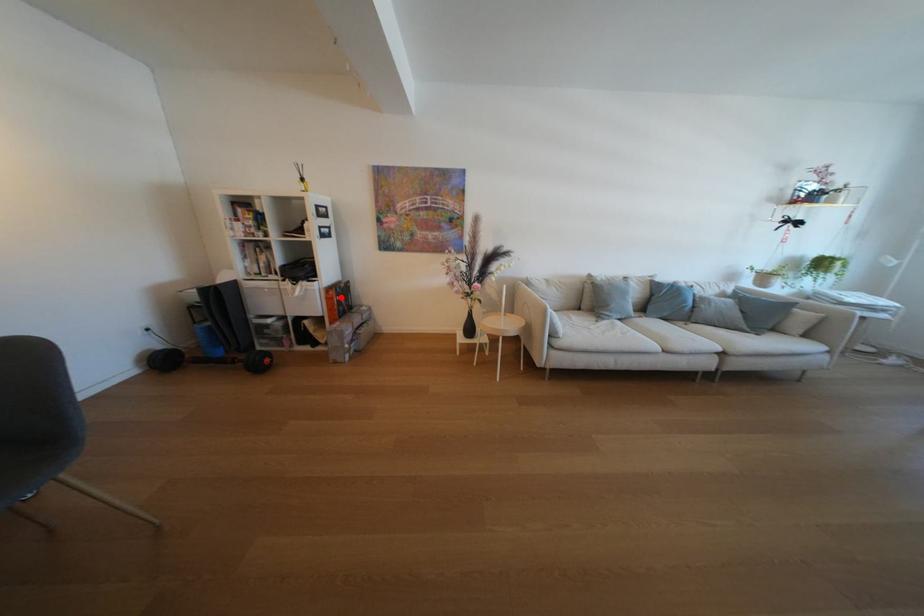
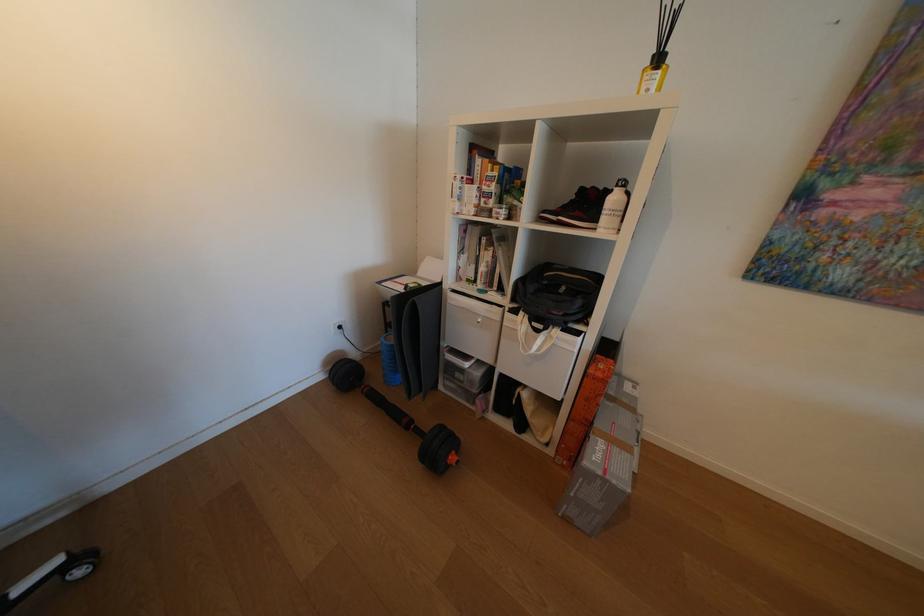
Question: I am providing you with two images of the same scene from different viewpoints. Given a red point in image1, look at the same physical point in image2. Is it:

Choices:
 (A) Closer to the viewpoint
 (B) Farther from the viewpoint

Answer: (B)